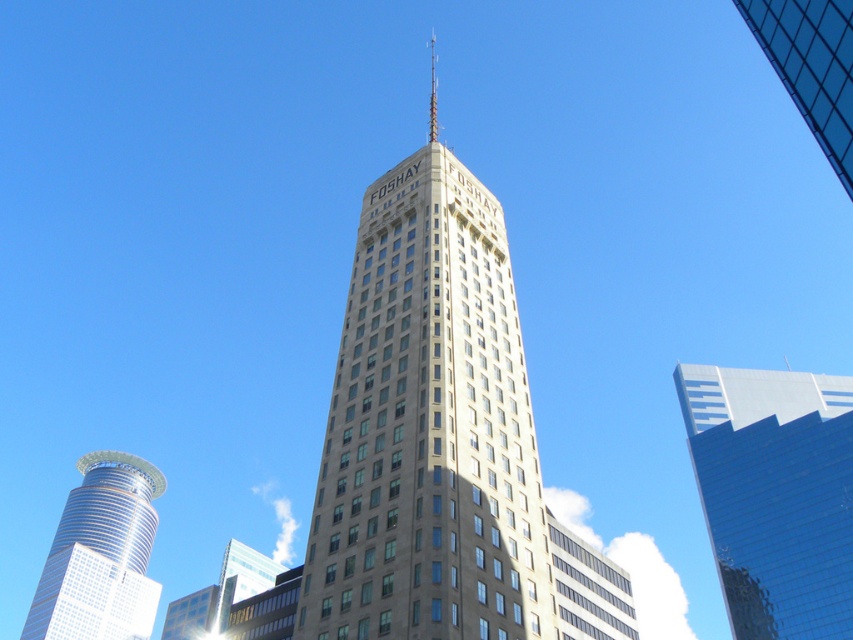
Between point (787, 440) and point (821, 68), which one is positioned behind?

The point (787, 440) is behind.

Between glassy reflective skyscraper at right and transparent glass building at upper right, which one has more height?

glassy reflective skyscraper at right is taller.

Does point (782, 550) lie in front of point (805, 90)?

That is False.

The height and width of the screenshot is (640, 853). What are the coordinates of `glassy reflective skyscraper at right` in the screenshot? It's located at (775, 493).

Looking at this image, is beige glass tower at center bigger than shiny silver tower at lower left?

Correct, beige glass tower at center is larger in size than shiny silver tower at lower left.

Can you confirm if beige glass tower at center is wider than shiny silver tower at lower left?

No.

Who is more forward, (526,396) or (138,515)?

Point (526,396) is in front.

The image size is (853, 640). Identify the location of beige glass tower at center. (428, 428).

Can you confirm if beige glass tower at center is positioned to the left of transparent glass building at upper right?

Correct, you'll find beige glass tower at center to the left of transparent glass building at upper right.

Does point (485, 305) come behind point (848, 99)?

That is True.

The image size is (853, 640). I want to click on beige glass tower at center, so click(x=428, y=428).